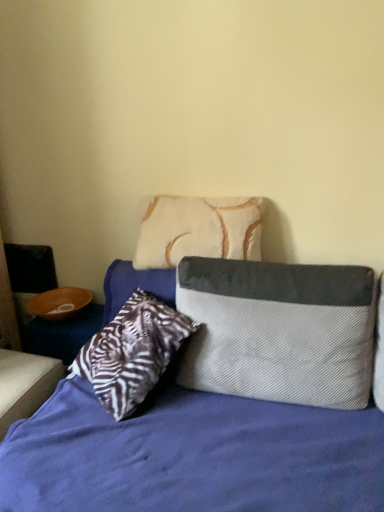
Question: Can you confirm if textured gray pillow at center, arranged as the 1th pillow when ordered from the bottom, is positioned to the left of white fur pillow at upper center, which is counted as the 2th pillow, starting from the bottom?

Choices:
 (A) yes
 (B) no

Answer: (B)

Question: From a real-world perspective, is textured gray pillow at center, positioned as the 2th pillow in top-to-bottom order, over white fur pillow at upper center, which is the 1th pillow in top-to-bottom order?

Choices:
 (A) no
 (B) yes

Answer: (A)

Question: Is textured gray pillow at center, positioned as the 2th pillow in top-to-bottom order, facing towards white fur pillow at upper center, which is counted as the 2th pillow, starting from the bottom?

Choices:
 (A) no
 (B) yes

Answer: (A)

Question: Is white fur pillow at upper center, which is counted as the 2th pillow, starting from the bottom, completely or partially inside textured gray pillow at center, arranged as the 1th pillow when ordered from the bottom?

Choices:
 (A) yes
 (B) no

Answer: (B)

Question: From the image's perspective, does textured gray pillow at center, positioned as the 2th pillow in top-to-bottom order, appear lower than white fur pillow at upper center, which is counted as the 2th pillow, starting from the bottom?

Choices:
 (A) yes
 (B) no

Answer: (A)

Question: Is textured gray pillow at center, arranged as the 1th pillow when ordered from the bottom, behind white fur pillow at upper center, which is the 1th pillow in top-to-bottom order?

Choices:
 (A) no
 (B) yes

Answer: (A)

Question: From the image's perspective, is white fur pillow at upper center, which is the 1th pillow in top-to-bottom order, beneath textured gray and white pillow at center?

Choices:
 (A) no
 (B) yes

Answer: (A)

Question: Considering the relative sizes of white fur pillow at upper center, which is counted as the 2th pillow, starting from the bottom, and textured gray and white pillow at center in the image provided, is white fur pillow at upper center, which is counted as the 2th pillow, starting from the bottom, shorter than textured gray and white pillow at center?

Choices:
 (A) yes
 (B) no

Answer: (A)

Question: Would you say textured gray and white pillow at center is part of white fur pillow at upper center, which is counted as the 2th pillow, starting from the bottom,'s contents?

Choices:
 (A) no
 (B) yes

Answer: (A)

Question: From a real-world perspective, is white fur pillow at upper center, which is the 1th pillow in top-to-bottom order, under textured gray and white pillow at center?

Choices:
 (A) no
 (B) yes

Answer: (A)

Question: Is white fur pillow at upper center, which is the 1th pillow in top-to-bottom order, further to the viewer compared to textured gray and white pillow at center?

Choices:
 (A) no
 (B) yes

Answer: (B)

Question: Does white fur pillow at upper center, which is the 1th pillow in top-to-bottom order, appear on the right side of textured gray and white pillow at center?

Choices:
 (A) no
 (B) yes

Answer: (A)

Question: Is textured gray and white pillow at center aimed at white fur pillow at upper center, which is counted as the 2th pillow, starting from the bottom?

Choices:
 (A) no
 (B) yes

Answer: (A)